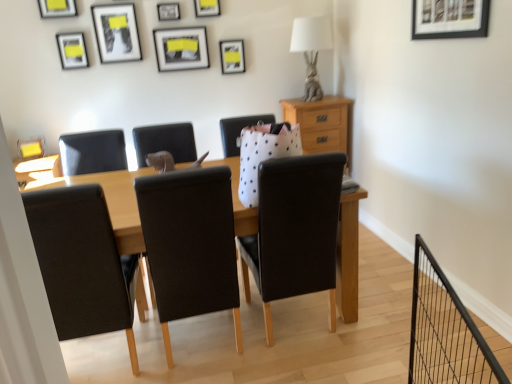
Measure the distance between matte black picture frame at upper center, marked as the third picture frame in a front-to-back arrangement, and camera.

matte black picture frame at upper center, marked as the third picture frame in a front-to-back arrangement, is 3.20 meters from camera.

What do you see at coordinates (207, 8) in the screenshot?
I see `matte black picture frame at upper center, the 7th picture frame from the left` at bounding box center [207, 8].

What do you see at coordinates (450, 18) in the screenshot?
I see `black matte picture frame at upper right, which ranks as the first picture frame in front-to-back order` at bounding box center [450, 18].

What do you see at coordinates (311, 49) in the screenshot?
I see `white fabric lamp at upper center` at bounding box center [311, 49].

You are a GUI agent. You are given a task and a screenshot of the screen. Output one action in this format:
    pyautogui.click(x=<x>, y=<y>)
    Task: Click on the matte black picture frame at upper center, marked as the 4th picture frame in a left-to-right arrangement
    The width and height of the screenshot is (512, 384).
    Given the screenshot: What is the action you would take?
    pyautogui.click(x=116, y=32)

Is matte black picture frame at upper center, the 7th picture frame from the left, oriented away from matte black picture frame at upper center, the second picture frame when ordered from right to left?

matte black picture frame at upper center, the 7th picture frame from the left, is not turned away from matte black picture frame at upper center, the second picture frame when ordered from right to left.

From the picture: How many degrees apart are the facing directions of matte black picture frame at upper center, placed as the 3th picture frame when sorted from back to front, and matte black picture frame at upper center, the 1th picture frame in the back-to-front sequence?

The angular difference between matte black picture frame at upper center, placed as the 3th picture frame when sorted from back to front, and matte black picture frame at upper center, the 1th picture frame in the back-to-front sequence, is 0.00145 degrees.

Does point (198, 5) come in front of point (228, 58)?

Yes.

Can you confirm if matte black picture frame at upper center, placed as the 3th picture frame when sorted from back to front, is thinner than matte black picture frame at upper center, the second picture frame when ordered from right to left?

Yes, matte black picture frame at upper center, placed as the 3th picture frame when sorted from back to front, is thinner than matte black picture frame at upper center, the second picture frame when ordered from right to left.

Does point (349, 166) come farther from viewer compared to point (201, 36)?

That is True.

Are light brown wood at upper right and matte black picture frame at upper center, marked as the 4th picture frame in a right-to-left arrangement, located far from each other?

light brown wood at upper right is positioned a significant distance from matte black picture frame at upper center, marked as the 4th picture frame in a right-to-left arrangement.

Looking at their sizes, would you say light brown wood at upper right is wider or thinner than matte black picture frame at upper center, which appears as the eighth picture frame when viewed from the front?

In the image, light brown wood at upper right appears to be wider than matte black picture frame at upper center, which appears as the eighth picture frame when viewed from the front.

From the light brown wood at upper right, count the 3rd picture frame to the left and point to it. Please provide its 2D coordinates.

[(181, 48)]

Considering the relative positions of matte black picture frame at upper center, marked as the third picture frame in a front-to-back arrangement, and light brown wood at upper right in the image provided, is matte black picture frame at upper center, marked as the third picture frame in a front-to-back arrangement, to the left or to the right of light brown wood at upper right?

In the image, matte black picture frame at upper center, marked as the third picture frame in a front-to-back arrangement, appears on the left side of light brown wood at upper right.

Between matte black picture frame at upper center, arranged as the sixth picture frame when viewed from the right, and light brown wood at upper right, which one has smaller width?

With smaller width is matte black picture frame at upper center, arranged as the sixth picture frame when viewed from the right.

Is matte black picture frame at upper center, marked as the third picture frame in a front-to-back arrangement, aimed at light brown wood at upper right?

No.

Is brushed metal picture frame at upper left, the fifth picture frame in the front-to-back sequence, completely or partially outside of matte black picture frame at upper center, which ranks as the 3th picture frame in right-to-left order?

brushed metal picture frame at upper left, the fifth picture frame in the front-to-back sequence, lies outside matte black picture frame at upper center, which ranks as the 3th picture frame in right-to-left order,'s area.

How many degrees apart are the facing directions of brushed metal picture frame at upper left, marked as the 1th picture frame in a left-to-right arrangement, and matte black picture frame at upper center, the 7th picture frame viewed from the front?

13.4 degrees.

Does brushed metal picture frame at upper left, the fifth picture frame in the front-to-back sequence, have a larger size compared to matte black picture frame at upper center, which ranks as the 3th picture frame in right-to-left order?

Yes, brushed metal picture frame at upper left, the fifth picture frame in the front-to-back sequence, is bigger than matte black picture frame at upper center, which ranks as the 3th picture frame in right-to-left order.

Based on their sizes in the image, would you say brushed metal picture frame at upper left, the fifth picture frame when ordered from back to front, is bigger or smaller than matte black picture frame at upper center, the 1th picture frame in the back-to-front sequence?

brushed metal picture frame at upper left, the fifth picture frame when ordered from back to front, is bigger than matte black picture frame at upper center, the 1th picture frame in the back-to-front sequence.

Is brushed metal picture frame at upper left, the ninth picture frame positioned from the right, in front of or behind matte black picture frame at upper center, the second picture frame when ordered from right to left, in the image?

brushed metal picture frame at upper left, the ninth picture frame positioned from the right, is in front of matte black picture frame at upper center, the second picture frame when ordered from right to left.

Which is nearer, (25, 150) or (237, 60)?

The point (25, 150) is more forward.

From the image's perspective, which one is positioned higher, brushed metal picture frame at upper left, the fifth picture frame when ordered from back to front, or matte black picture frame at upper center, the 1th picture frame in the back-to-front sequence?

matte black picture frame at upper center, the 1th picture frame in the back-to-front sequence, from the image's perspective.

Based on the photo, is black matte picture frame at upper right, which ranks as the first picture frame in front-to-back order, positioned beyond the bounds of light brown wood at upper right?

Yes, black matte picture frame at upper right, which ranks as the first picture frame in front-to-back order, is outside of light brown wood at upper right.

Locate an element on the screen. the 5th picture frame directly above the light brown wood at upper right (from a real-world perspective) is located at coordinates (450, 18).

Can you tell me how much black matte picture frame at upper right, which ranks as the first picture frame in front-to-back order, and light brown wood at upper right differ in facing direction?

The angular difference between black matte picture frame at upper right, which ranks as the first picture frame in front-to-back order, and light brown wood at upper right is 90.2 degrees.

Looking at the image, does white fabric lamp at upper center seem bigger or smaller compared to metallic silver picture frame at upper left, which appears as the 2th picture frame when viewed from the left?

Clearly, white fabric lamp at upper center is larger in size than metallic silver picture frame at upper left, which appears as the 2th picture frame when viewed from the left.

Between white fabric lamp at upper center and metallic silver picture frame at upper left, arranged as the eighth picture frame when viewed from the right, which one appears on the right side from the viewer's perspective?

white fabric lamp at upper center.

Is white fabric lamp at upper center facing towards metallic silver picture frame at upper left, arranged as the eighth picture frame when viewed from the right?

No, white fabric lamp at upper center is not facing towards metallic silver picture frame at upper left, arranged as the eighth picture frame when viewed from the right.

How many degrees apart are the facing directions of white fabric lamp at upper center and metallic silver picture frame at upper left, the 2th picture frame positioned from the front?

The angle between the facing direction of white fabric lamp at upper center and the facing direction of metallic silver picture frame at upper left, the 2th picture frame positioned from the front, is 4.13 degrees.

From the matte black picture frame at upper center, which ranks as the 3th picture frame in right-to-left order, count 2nd picture frames backward and point to it. Please provide its 2D coordinates.

[(232, 56)]

Where is `the 1st picture frame in front of the light brown wood at upper right`? the 1st picture frame in front of the light brown wood at upper right is located at coordinates (181, 48).

Based on their spatial positions, is black matte picture frame at upper right, which ranks as the first picture frame in front-to-back order, or matte black picture frame at upper center, the 1th picture frame in the back-to-front sequence, closer to matte black picture frame at upper center, placed as the 3th picture frame when sorted from back to front?

Based on the image, matte black picture frame at upper center, the 1th picture frame in the back-to-front sequence, appears to be nearer to matte black picture frame at upper center, placed as the 3th picture frame when sorted from back to front.

Based on the photo, looking at the image, which one is located closer to matte black picture frame at upper center, the second picture frame when ordered from right to left, matte black picture frame at upper left, arranged as the fourth picture frame when viewed from the front, or matte black picture frame at upper center, which ranks as the 3th picture frame in right-to-left order?

matte black picture frame at upper center, which ranks as the 3th picture frame in right-to-left order, is closer to matte black picture frame at upper center, the second picture frame when ordered from right to left.

From the picture: Based on their spatial positions, is matte black picture frame at upper center, which ranks as the 3th picture frame in right-to-left order, or black matte picture frame at upper right, placed as the 1th picture frame when sorted from right to left, further from matte black picture frame at upper center, marked as the 4th picture frame in a right-to-left arrangement?

The object further to matte black picture frame at upper center, marked as the 4th picture frame in a right-to-left arrangement, is black matte picture frame at upper right, placed as the 1th picture frame when sorted from right to left.

From the image, which object appears to be nearer to metallic silver picture frame at upper left, arranged as the eighth picture frame when viewed from the right, black matte picture frame at upper right, which ranks as the first picture frame in front-to-back order, or light brown wood at upper right?

light brown wood at upper right is closer to metallic silver picture frame at upper left, arranged as the eighth picture frame when viewed from the right.

Considering their positions, is light brown wood at upper right positioned closer to white fabric lamp at upper center than matte black picture frame at upper left, arranged as the fourth picture frame when viewed from the front?

light brown wood at upper right is positioned closer to the anchor white fabric lamp at upper center.

Based on their spatial positions, is matte black picture frame at upper center, the 7th picture frame from the left, or matte black picture frame at upper center, marked as the third picture frame in a front-to-back arrangement, further from brushed metal picture frame at upper left, the fifth picture frame in the front-to-back sequence?

matte black picture frame at upper center, the 7th picture frame from the left.

When comparing their distances from brushed metal picture frame at upper left, the fifth picture frame when ordered from back to front, does matte black picture frame at upper center, marked as the third picture frame in a front-to-back arrangement, or matte black picture frame at upper center, the 7th picture frame from the left, seem closer?

matte black picture frame at upper center, marked as the third picture frame in a front-to-back arrangement, is closer to brushed metal picture frame at upper left, the fifth picture frame when ordered from back to front.

Which object lies nearer to the anchor point matte black picture frame at upper center, arranged as the sixth picture frame when viewed from the right, metallic silver picture frame at upper center, which is the fifth picture frame in left-to-right order, or light brown wood at upper right?

metallic silver picture frame at upper center, which is the fifth picture frame in left-to-right order, is positioned closer to the anchor matte black picture frame at upper center, arranged as the sixth picture frame when viewed from the right.

I want to click on picture frame located between matte black picture frame at upper center, the 7th picture frame from the left, and white fabric lamp at upper center in the left-right direction, so click(232, 56).

At what (x,y) coordinates should I click in order to perform the action: click on picture frame situated between metallic silver picture frame at upper left, arranged as the eighth picture frame when viewed from the right, and matte black picture frame at upper center, positioned as the seventh picture frame in back-to-front order, from left to right. Please return your answer as a coordinate pair (x, y). The image size is (512, 384). Looking at the image, I should click on (72, 50).

The height and width of the screenshot is (384, 512). I want to click on table lamp between metallic silver picture frame at upper left, the 2th picture frame positioned from the front, and black matte picture frame at upper right, which ranks as the first picture frame in front-to-back order, in the horizontal direction, so click(x=311, y=49).

At what (x,y) coordinates should I click in order to perform the action: click on table lamp between matte black picture frame at upper center, positioned as the seventh picture frame in back-to-front order, and black matte picture frame at upper right, which ranks as the first picture frame in front-to-back order, in the horizontal direction. Please return your answer as a coordinate pair (x, y). This screenshot has width=512, height=384. Looking at the image, I should click on (311, 49).